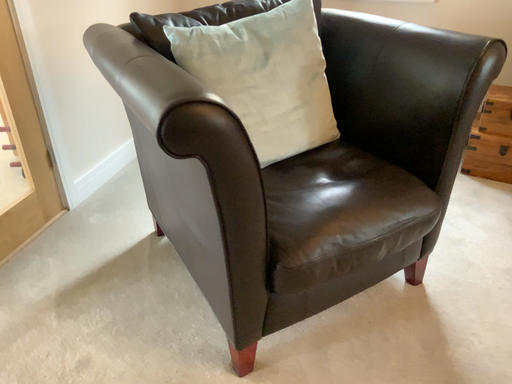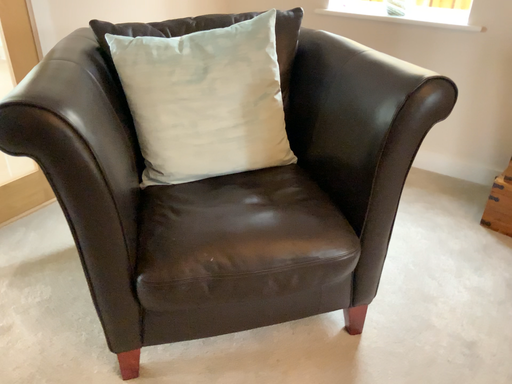
Question: Which way did the camera rotate in the video?

Choices:
 (A) rotated left
 (B) rotated right

Answer: (A)